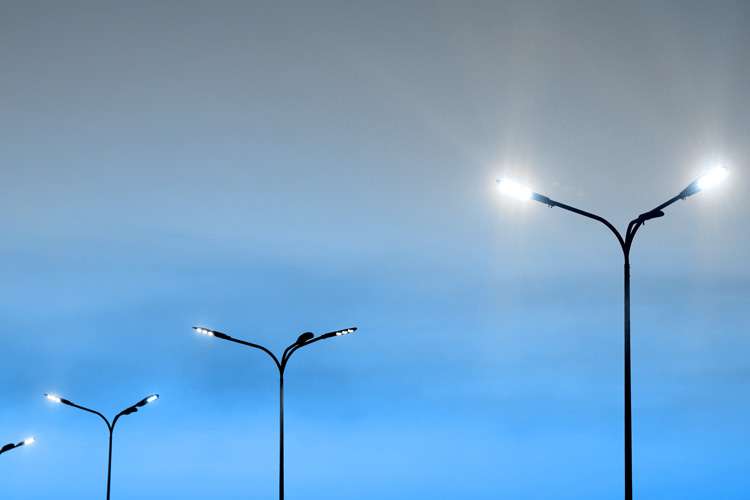
Locate an element on the screen. Image resolution: width=750 pixels, height=500 pixels. light is located at coordinates (150, 398).